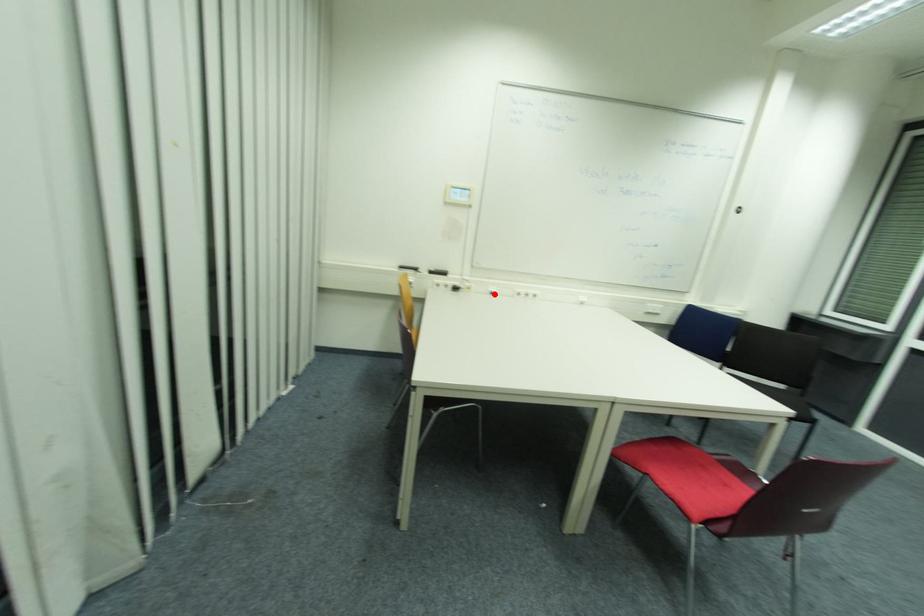
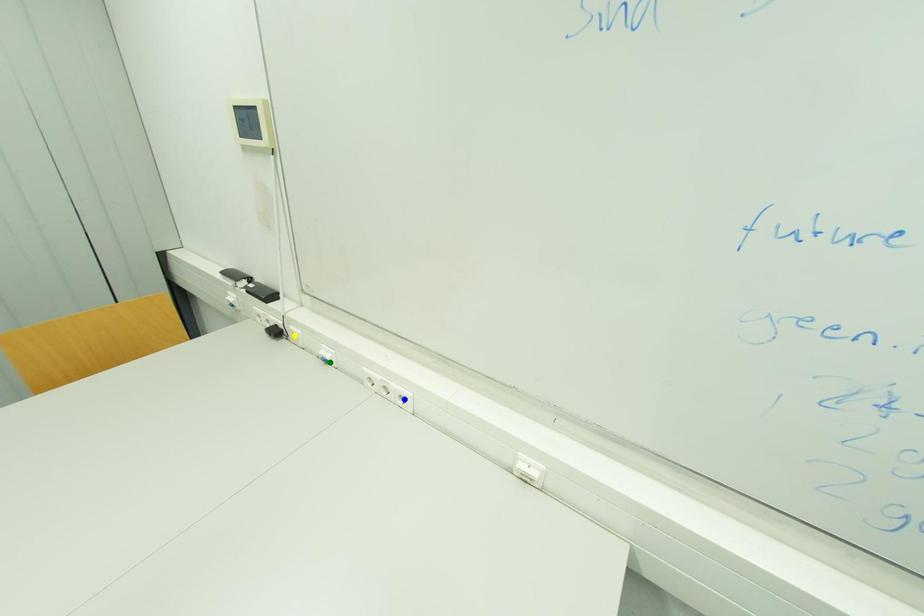
Question: I am providing you with two images of the same scene from different viewpoints. A red point is marked on the first image. You are given multiple points on the second image. Can you choose the point in image 2 that corresponds to the point in image 1?

Choices:
 (A) blue point
 (B) yellow point
 (C) green point

Answer: (C)